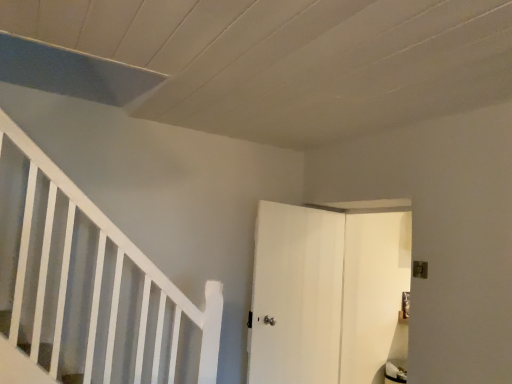
Question: From the image's perspective, is smooth gray stair at lower left located above or below white matte door at center, the first door when ordered from right to left?

Choices:
 (A) above
 (B) below

Answer: (A)

Question: Looking at their shapes, would you say smooth gray stair at lower left is wider or thinner than white matte door at center, positioned as the 2th door in left-to-right order?

Choices:
 (A) wide
 (B) thin

Answer: (B)

Question: Estimate the real-world distances between objects in this image. Which object is closer to the smooth gray stair at lower left?

Choices:
 (A) white matte door at center, positioned as the 2th door in left-to-right order
 (B) white matte door at center, which is counted as the second door, starting from the right

Answer: (B)

Question: Which object is positioned farthest from the white matte door at center, the first door when ordered from right to left?

Choices:
 (A) smooth gray stair at lower left
 (B) white matte door at center, which ranks as the 1th door in left-to-right order

Answer: (A)